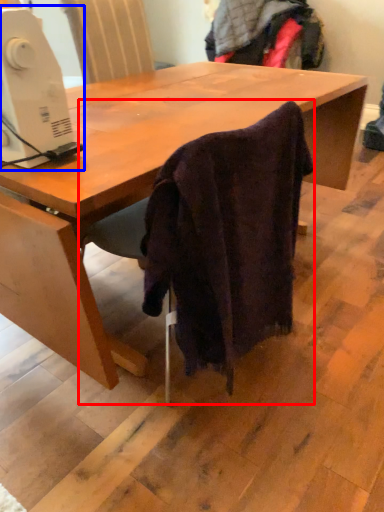
Question: Which object appears farthest to the camera in this image, chair (highlighted by a red box) or sewing machine (highlighted by a blue box)?

Choices:
 (A) chair
 (B) sewing machine

Answer: (A)